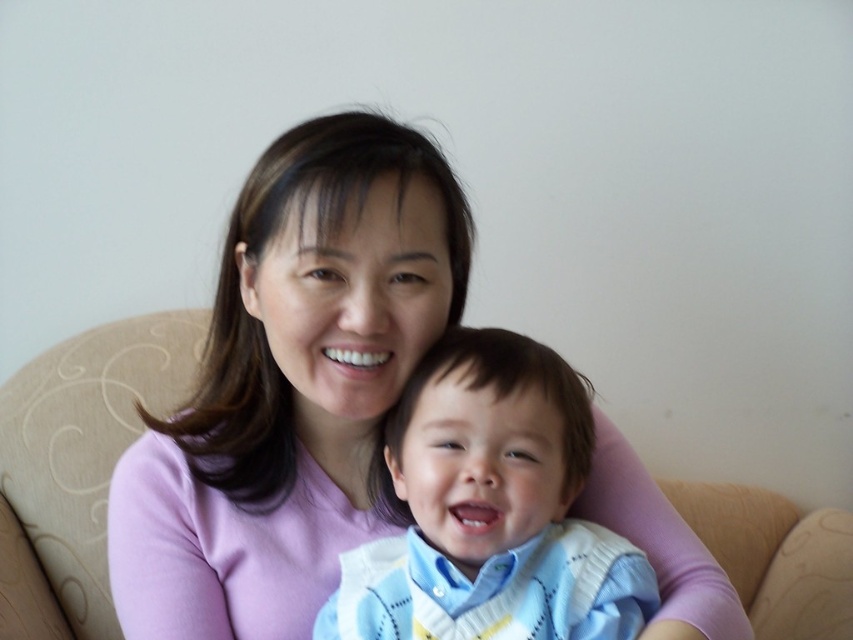
You are a photographer adjusting your camera to focus on two specific points in the image. The first point is point (468, 272) and the second is point (583, 401). Which point should you focus on first if you want to ensure the closest object is in focus?

Point (468, 272) is further to the camera than point (583, 401), so you should focus on point (468, 272) first to ensure the closest object is in focus.

You are a photographer trying to capture a closeup of the pink soft sweater at center in the scene. Based on the coordinates provided, where should you focus your camera lens to ensure the sweater is in sharp focus?

You should focus your camera lens at point (291,387) to ensure the pink soft sweater at center is in sharp focus.